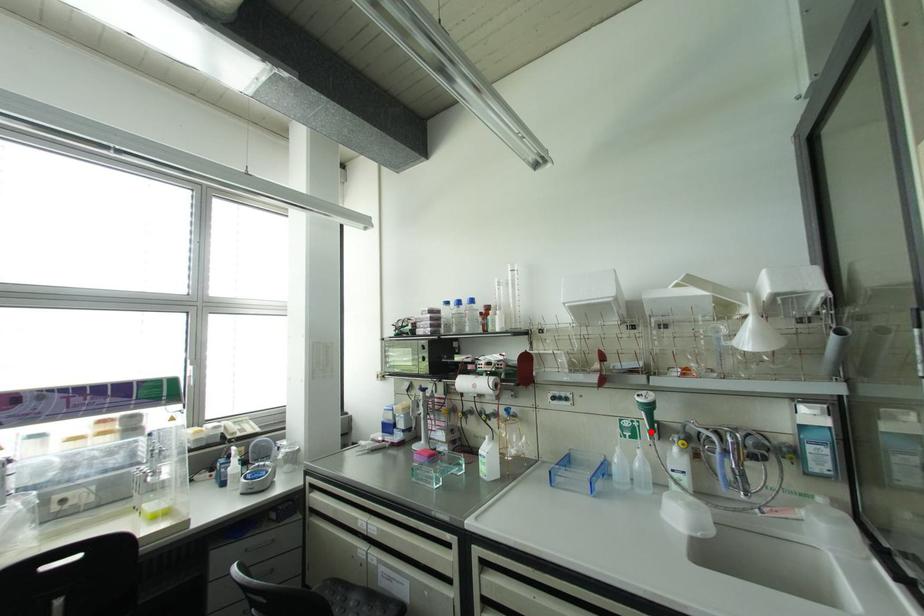
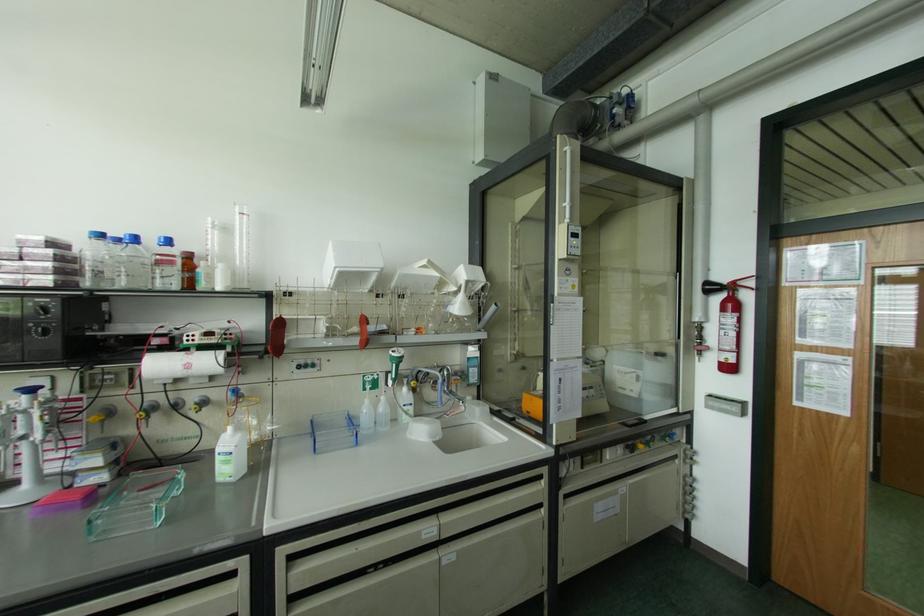
Where in the second image is the point corresponding to the highlighted location from the first image?

(394, 379)